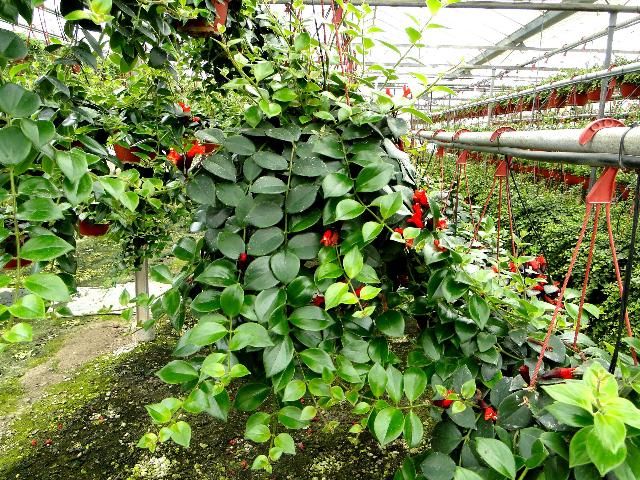
The image size is (640, 480). I want to click on flower pots, so click(x=595, y=96), click(x=570, y=179), click(x=92, y=231).